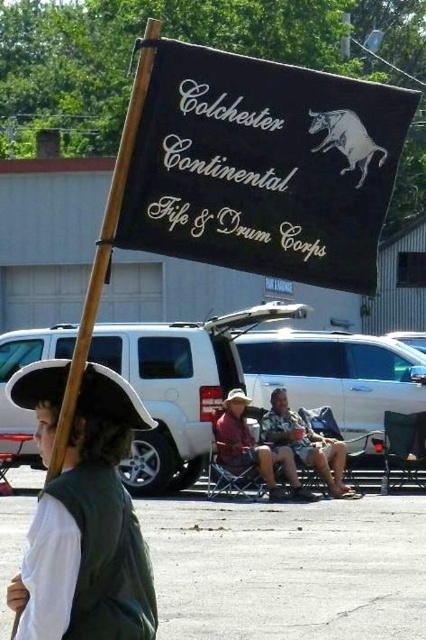
Question: Estimate the real-world distances between objects in this image. Which object is closer to the camouflage fabric shorts at center?

Choices:
 (A) black fabric sign at upper center
 (B) wooden pole at upper left
 (C) white matte hat at left
 (D) denim jacket at center

Answer: (D)

Question: Which is farther from the wooden pole at upper left?

Choices:
 (A) camouflage fabric shorts at center
 (B) denim jacket at center

Answer: (A)

Question: Observing the image, what is the correct spatial positioning of white matte hat at left in reference to camouflage fabric shorts at center?

Choices:
 (A) above
 (B) below

Answer: (A)

Question: Which of the following is the closest to the observer?

Choices:
 (A) black fabric sign at upper center
 (B) denim jacket at center
 (C) camouflage fabric shorts at center

Answer: (A)

Question: Can you confirm if white matte hat at left is positioned to the left of denim jacket at center?

Choices:
 (A) yes
 (B) no

Answer: (A)

Question: Is white matte hat at left in front of camouflage fabric shorts at center?

Choices:
 (A) yes
 (B) no

Answer: (A)